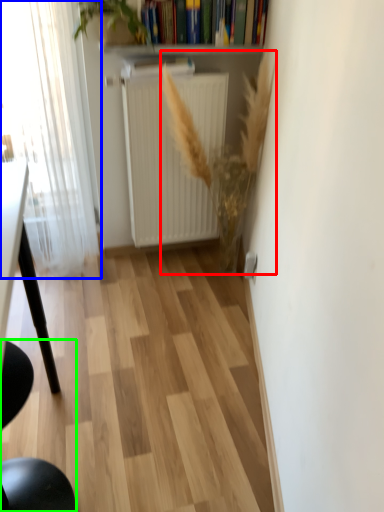
Question: Which object is positioned farthest from plant (highlighted by a red box)? Select from window (highlighted by a blue box) and chair (highlighted by a green box).

Choices:
 (A) window
 (B) chair

Answer: (B)